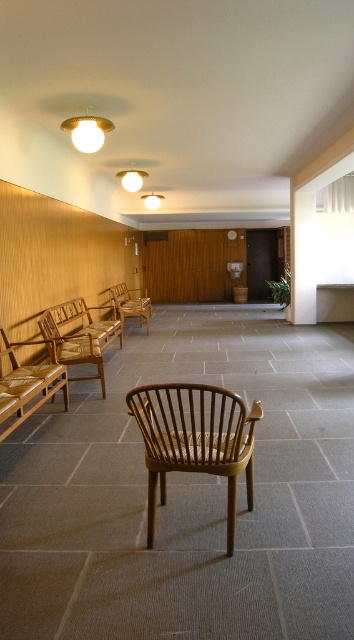
Question: Which point is farther from the camera taking this photo?

Choices:
 (A) (128, 317)
 (B) (2, 376)
 (C) (151, 432)

Answer: (A)

Question: Which object is farther from the camera taking this photo?

Choices:
 (A) light brown wooden bench at left
 (B) brown woven bench at left
 (C) wooden woven chair at left

Answer: (B)

Question: In this image, where is brown woven chair at center located relative to brown woven bench at left?

Choices:
 (A) below
 (B) above

Answer: (A)

Question: Is brown woven chair at center to the right of brown woven bench at left from the viewer's perspective?

Choices:
 (A) no
 (B) yes

Answer: (B)

Question: Can you confirm if brown woven chair at center is positioned to the left of brown woven bench at left?

Choices:
 (A) no
 (B) yes

Answer: (A)

Question: Estimate the real-world distances between objects in this image. Which object is farther from the light brown wooden bench at left?

Choices:
 (A) brown woven chair at center
 (B) wooden woven chair at left
 (C) brown woven bench at left

Answer: (C)